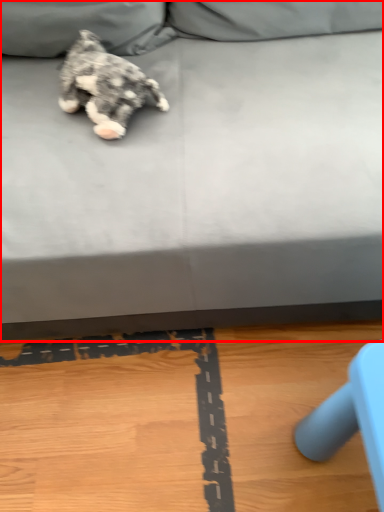
Question: In this image, where is studio couch (annotated by the red box) located relative to dog?

Choices:
 (A) right
 (B) left

Answer: (A)